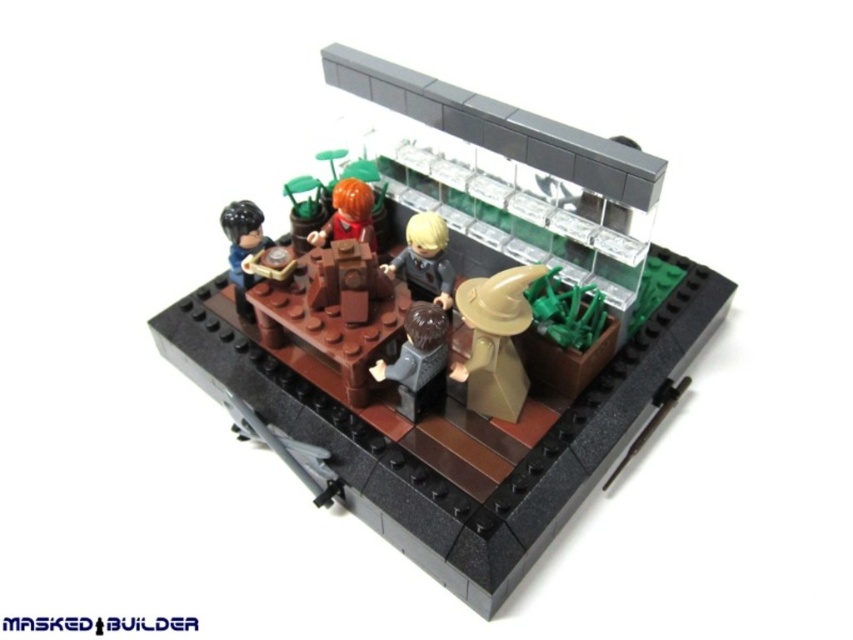
Between point (434, 308) and point (242, 234), which one is positioned behind?

The point (242, 234) is behind.

Can you confirm if brown matte wizard hat at center is bigger than smooth black hair at left?

Yes.

Between point (428, 380) and point (242, 234), which one is positioned in front?

Point (428, 380) is more forward.

This screenshot has width=853, height=640. In order to click on brown matte wizard hat at center in this screenshot , I will do `click(419, 360)`.

Which is behind, point (514, 198) or point (233, 243)?

The point (233, 243) is more distant.

Who is lower down, brown matte table at center or smooth black hair at left?

brown matte table at center

I want to click on brown matte table at center, so click(x=450, y=388).

At what (x,y) coordinates should I click in order to perform the action: click on brown matte table at center. Please return your answer as a coordinate pair (x, y). The width and height of the screenshot is (853, 640). Looking at the image, I should click on (450, 388).

How far apart are brown matte table at center and brown matte wizard hat at center?

They are 7.57 inches apart.

Is brown matte table at center bigger than brown matte wizard hat at center?

Yes, brown matte table at center is bigger than brown matte wizard hat at center.

Find the location of a particular element. brown matte table at center is located at coordinates (450, 388).

The height and width of the screenshot is (640, 853). I want to click on brown matte table at center, so click(450, 388).